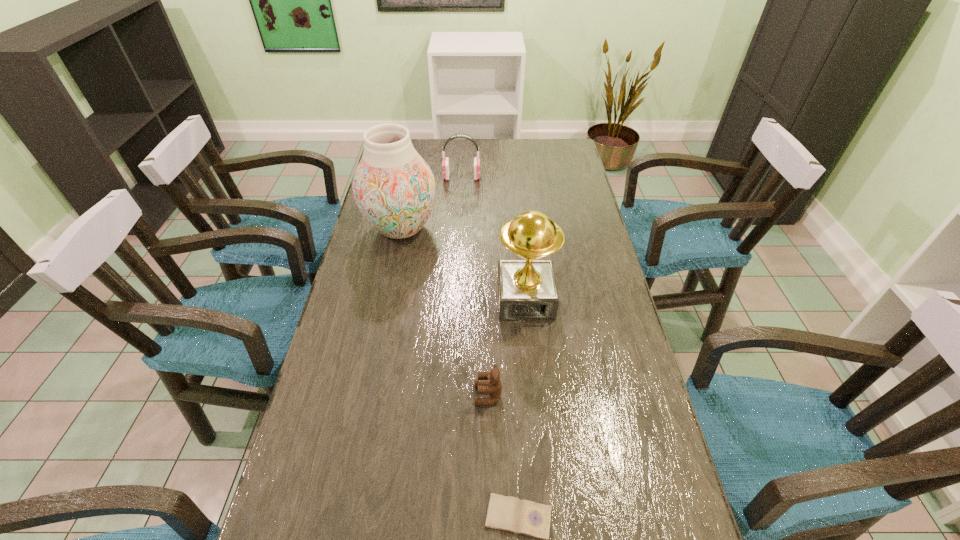
Identify the location of vacant area that lies between the third farthest object and the fourth farthest object. This screenshot has height=540, width=960. (507, 347).

The width and height of the screenshot is (960, 540). Identify the location of unoccupied area between the award and the fourth tallest object. (507, 347).

Identify which object is located as the nearest to the teddy bear. Please provide its 2D coordinates. Your answer should be formatted as a tuple, i.e. [(x, y)], where the tuple contains the x and y coordinates of a point satisfying the conditions above.

[(527, 291)]

Identify which object is located as the second nearest to the shortest object. Please provide its 2D coordinates. Your answer should be formatted as a tuple, i.e. [(x, y)], where the tuple contains the x and y coordinates of a point satisfying the conditions above.

[(527, 291)]

Where is `free location that satisfies the following two spatial constraints: 1. on the outer surface of the farthest object; 2. on the front side of the vase`? free location that satisfies the following two spatial constraints: 1. on the outer surface of the farthest object; 2. on the front side of the vase is located at coordinates (459, 228).